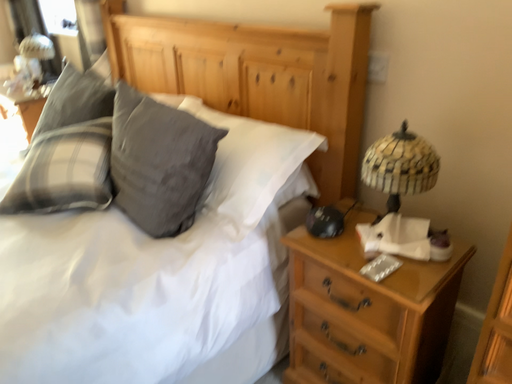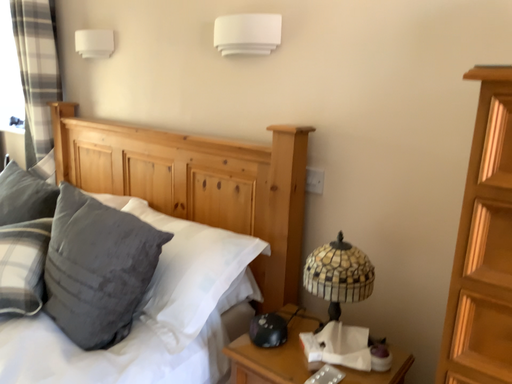
Question: Which way did the camera rotate in the video?

Choices:
 (A) rotated left
 (B) rotated right

Answer: (B)